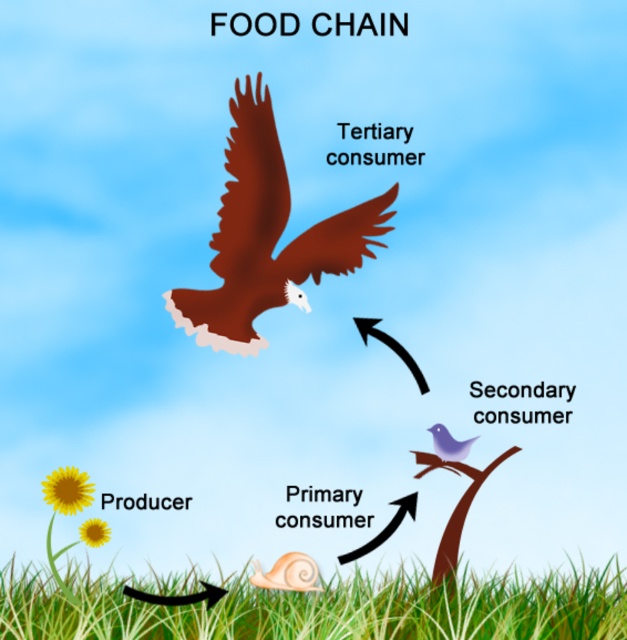
Question: Can you confirm if brown matte eagle at upper center is positioned to the right of purple matte bird at upper center?

Choices:
 (A) yes
 (B) no

Answer: (B)

Question: Does green grass at lower center have a smaller size compared to purple matte bird at upper center?

Choices:
 (A) yes
 (B) no

Answer: (B)

Question: Which object appears farthest from the camera in this image?

Choices:
 (A) purple matte bird at upper center
 (B) green grass at lower center
 (C) brown matte eagle at upper center

Answer: (A)

Question: Which of the following is the farthest from the observer?

Choices:
 (A) green grass at lower center
 (B) brown matte eagle at upper center
 (C) purple matte bird at upper center

Answer: (C)

Question: Which object appears farthest from the camera in this image?

Choices:
 (A) green grass at lower center
 (B) brown matte eagle at upper center

Answer: (B)

Question: Does green grass at lower center have a smaller size compared to brown matte eagle at upper center?

Choices:
 (A) no
 (B) yes

Answer: (A)